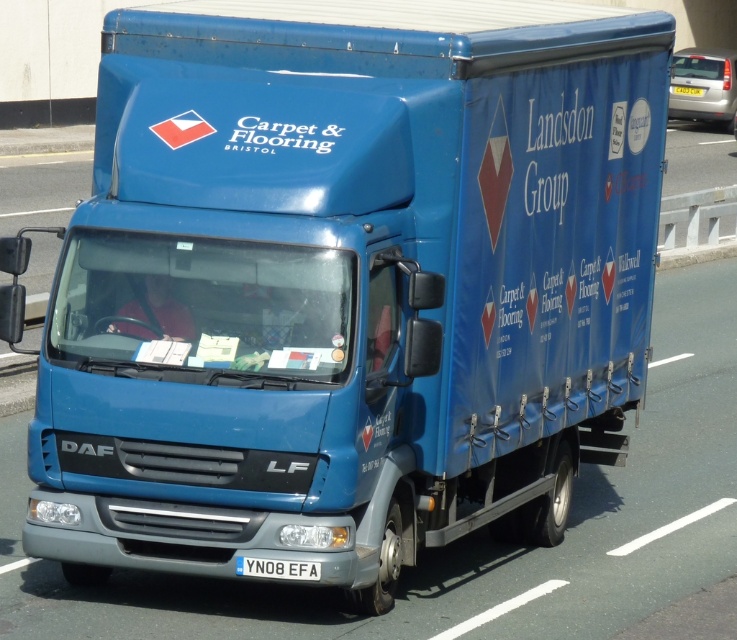
Is point (256, 561) behind point (682, 90)?

No, it is in front of (682, 90).

Between point (245, 566) and point (691, 88), which one is positioned in front?

Point (245, 566)

Image resolution: width=737 pixels, height=640 pixels. Identify the location of white plastic license plate at bottom. (276, 568).